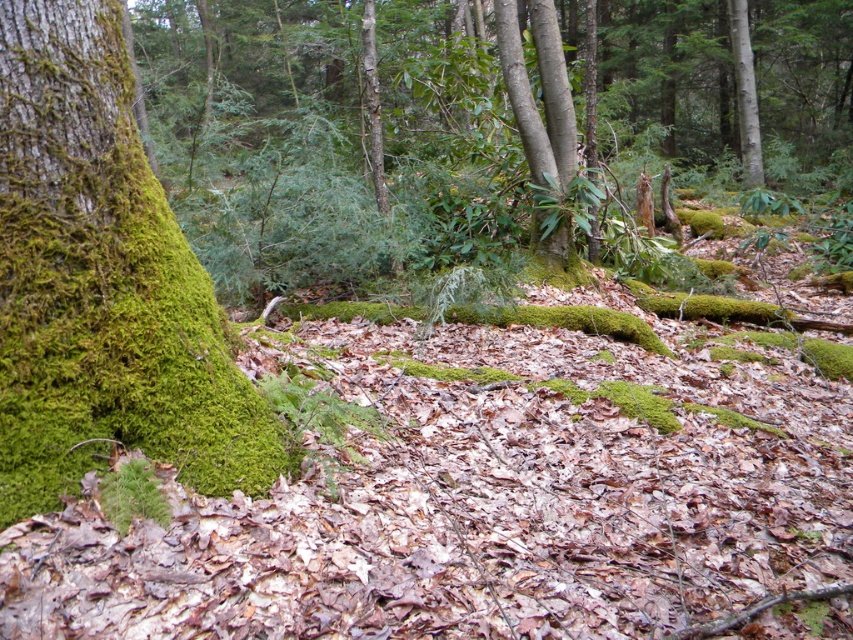
You are standing in the forest scene described. You want to place a small decorative stone exactly at the point with coordinates point [102,282]. Based on the scene description, where would this stone be placed?

The point [102,282] corresponds to the green mossy tree trunk at left, so the stone would be placed on the green mossy tree trunk at left.

You are a hiker trying to determine which tree has a wider trunk between the green mossy tree trunk at left and the smooth bark tree at center. Based on the scene, which one do you think is wider?

The green mossy tree trunk at left has a larger width than the smooth bark tree at center, so it is wider.